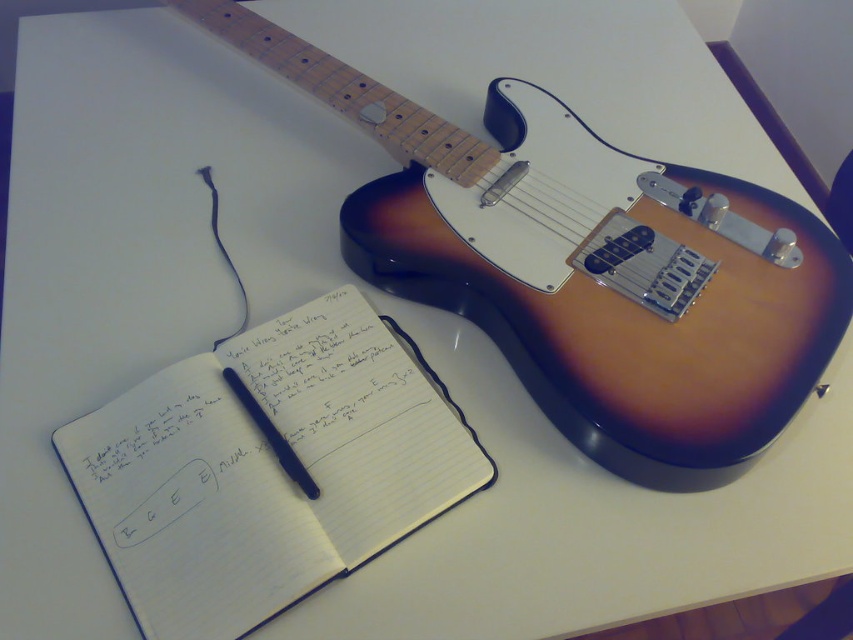
Is point (537, 136) positioned after point (289, 452)?

Yes.

Between satin wood guitar at upper right and matte black pen at center, which one is positioned higher?

satin wood guitar at upper right is above.

Which is in front, point (426, 179) or point (308, 496)?

Point (308, 496) is more forward.

I want to click on satin wood guitar at upper right, so point(587,266).

This screenshot has height=640, width=853. Describe the element at coordinates (265, 468) in the screenshot. I see `white lined paper at center` at that location.

Which is below, white lined paper at center or matte black pen at center?

white lined paper at center is lower down.

Which is behind, point (274, 484) or point (297, 468)?

The point (297, 468) is more distant.

Where is `white lined paper at center`? Image resolution: width=853 pixels, height=640 pixels. white lined paper at center is located at coordinates (265, 468).

Is satin wood guitar at upper right thinner than white lined paper at center?

Incorrect, satin wood guitar at upper right's width is not less than white lined paper at center's.

Is point (833, 342) closer to viewer compared to point (375, 330)?

Yes.

You are a GUI agent. You are given a task and a screenshot of the screen. Output one action in this format:
    pyautogui.click(x=<x>, y=<y>)
    Task: Click on the satin wood guitar at upper right
    
    Given the screenshot: What is the action you would take?
    pyautogui.click(x=587, y=266)